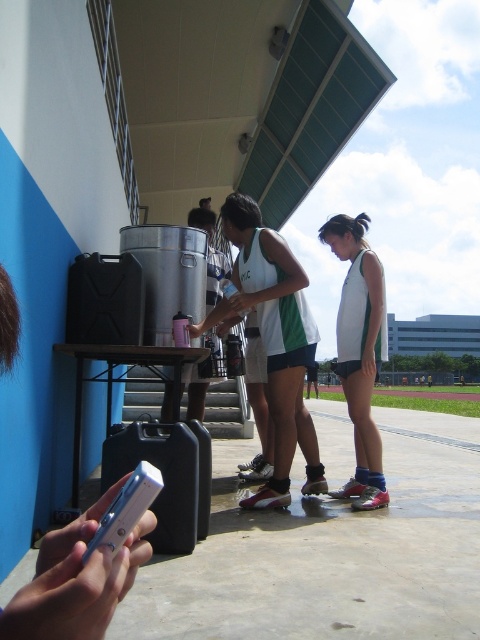
Question: From the image, what is the correct spatial relationship of black plastic suitcase at lower left in relation to silver metallic smartphone at lower left?

Choices:
 (A) right
 (B) left

Answer: (B)

Question: Which object appears closest to the camera in this image?

Choices:
 (A) silver metallic smartphone at lower left
 (B) white matte tank top at center

Answer: (A)

Question: Estimate the real-world distances between objects in this image. Which object is farther from the black plastic suitcase at lower left?

Choices:
 (A) white matte tank top at center
 (B) silver metallic smartphone at lower left

Answer: (B)

Question: Does white matte tank top at center have a smaller size compared to black plastic suitcase at lower left?

Choices:
 (A) no
 (B) yes

Answer: (A)

Question: Can you confirm if black plastic suitcase at lower left is bigger than silver metallic smartphone at lower left?

Choices:
 (A) no
 (B) yes

Answer: (B)

Question: Which object is the closest to the black plastic suitcase at lower left?

Choices:
 (A) white matte tank top at center
 (B) silver metallic smartphone at lower left

Answer: (A)